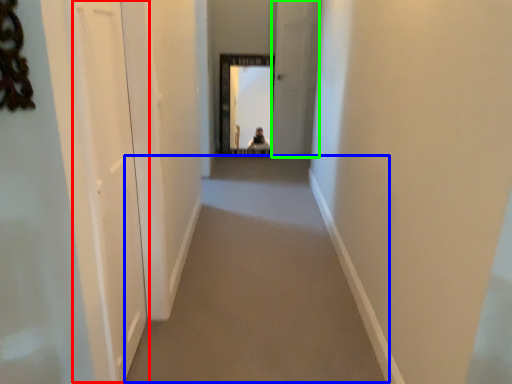
Question: Which is nearer to the screen door (highlighted by a red box)? corridor (highlighted by a blue box) or screen door (highlighted by a green box).

Choices:
 (A) corridor
 (B) screen door

Answer: (A)